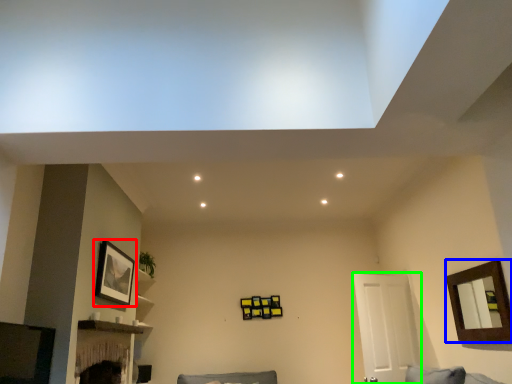
Question: Based on their relative distances, which object is farther from picture frame (highlighted by a red box)? Choose from picture frame (highlighted by a blue box) and door (highlighted by a green box).

Choices:
 (A) picture frame
 (B) door

Answer: (A)